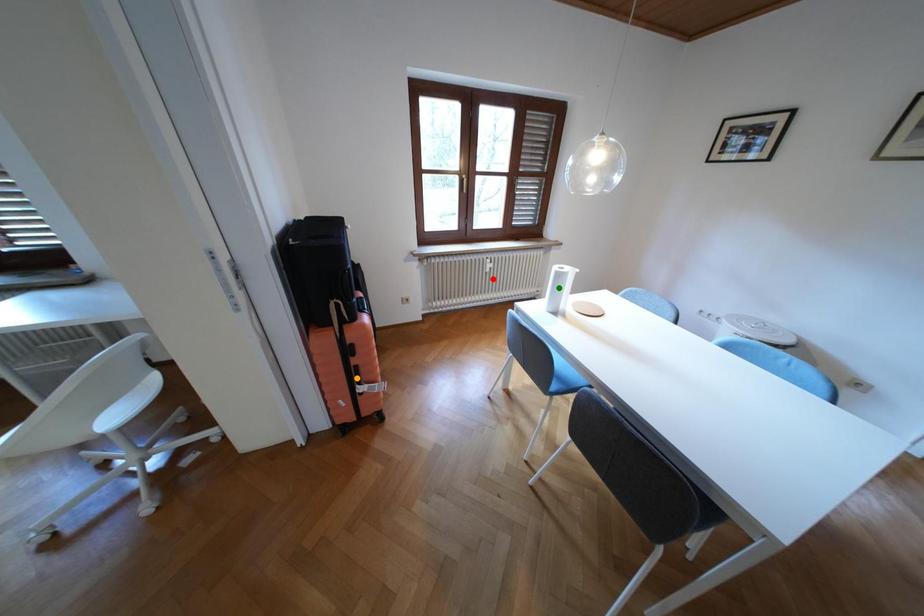
Order these from farthest to nearest:
1. red point
2. orange point
3. green point

green point < red point < orange point